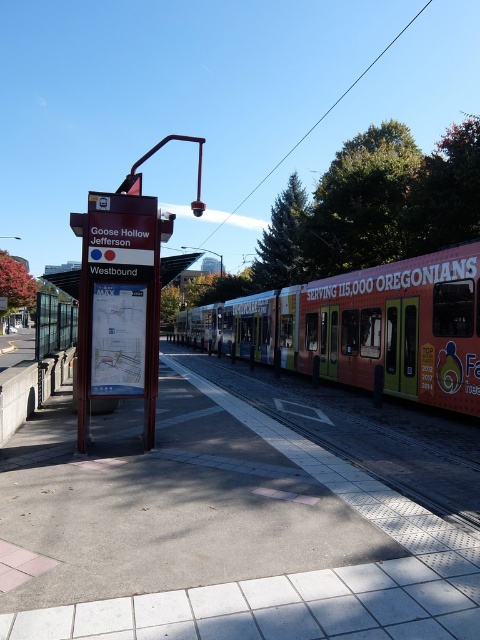
Does orange painted metal passenger train at center appear on the right side of metallic signboard at center?

Correct, you'll find orange painted metal passenger train at center to the right of metallic signboard at center.

What do you see at coordinates (365, 326) in the screenshot? This screenshot has height=640, width=480. I see `orange painted metal passenger train at center` at bounding box center [365, 326].

Where is `orange painted metal passenger train at center`? Image resolution: width=480 pixels, height=640 pixels. orange painted metal passenger train at center is located at coordinates (365, 326).

Based on the photo, is gray concrete pavement at center thinner than orange painted metal passenger train at center?

No.

Describe the element at coordinates (240, 516) in the screenshot. I see `gray concrete pavement at center` at that location.

Is point (252, 499) less distant than point (224, 337)?

Yes, it is in front of point (224, 337).

Locate an element on the screen. The width and height of the screenshot is (480, 640). gray concrete pavement at center is located at coordinates [240, 516].

Can you confirm if gray concrete pavement at center is taller than metallic train track at center?

Correct, gray concrete pavement at center is much taller as metallic train track at center.

Which is above, gray concrete pavement at center or metallic train track at center?

gray concrete pavement at center is above.

Is point (471, 502) behind point (323, 417)?

No, it is in front of (323, 417).

Where is `gray concrete pavement at center`? This screenshot has width=480, height=640. gray concrete pavement at center is located at coordinates (240, 516).